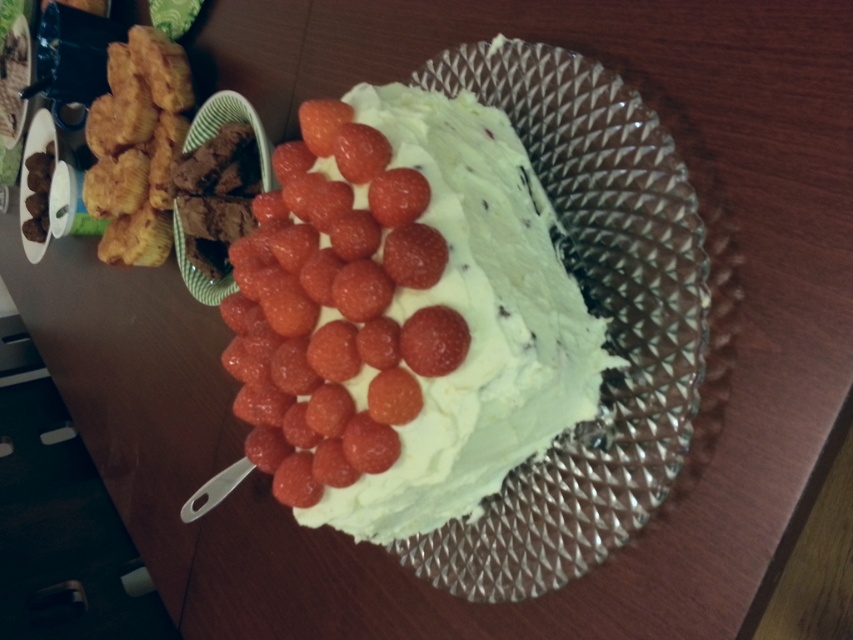
Question: Which of the following is the farthest from the observer?

Choices:
 (A) white creamy cake at center
 (B) clear glass plate at center
 (C) golden fried chicken at left

Answer: (C)

Question: Does clear glass plate at center appear under golden fried chicken at left?

Choices:
 (A) yes
 (B) no

Answer: (A)

Question: Is clear glass plate at center positioned before golden fried chicken at left?

Choices:
 (A) yes
 (B) no

Answer: (A)

Question: Which object is positioned closest to the clear glass plate at center?

Choices:
 (A) golden fried chicken at left
 (B) white creamy cake at center

Answer: (B)

Question: Considering the relative positions of clear glass plate at center and golden fried chicken at left in the image provided, where is clear glass plate at center located with respect to golden fried chicken at left?

Choices:
 (A) left
 (B) right

Answer: (B)

Question: Considering the real-world distances, which object is farthest from the clear glass plate at center?

Choices:
 (A) white creamy cake at center
 (B) golden fried chicken at left

Answer: (B)